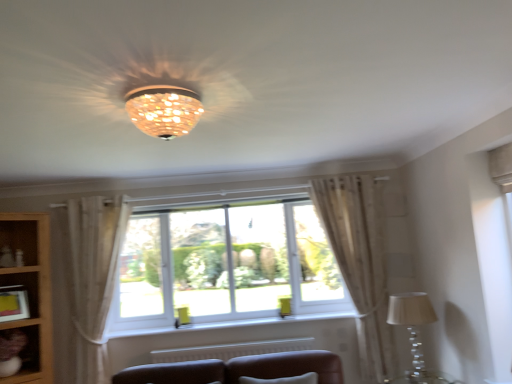
At what (x,y) coordinates should I click in order to perform the action: click on free space above white plastic window sill at center (from a real-world perspective). Please return your answer as a coordinate pair (x, y). This screenshot has height=384, width=512. Looking at the image, I should click on (217, 322).